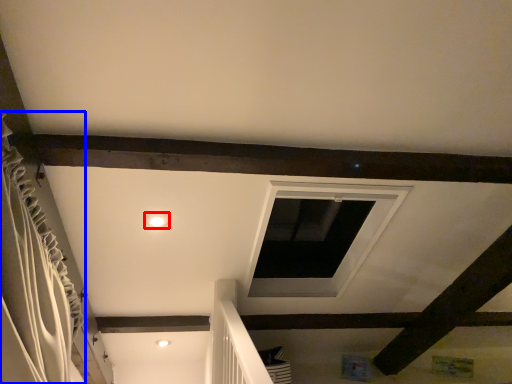
Question: Which object is further to the camera taking this photo, lighting (highlighted by a red box) or curtain (highlighted by a blue box)?

Choices:
 (A) lighting
 (B) curtain

Answer: (A)